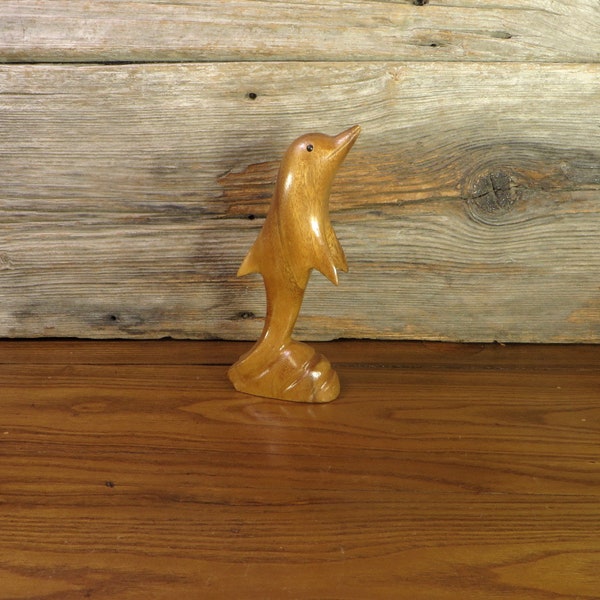
What are the coordinates of `wood drain on the table` in the screenshot? It's located at (268, 520).